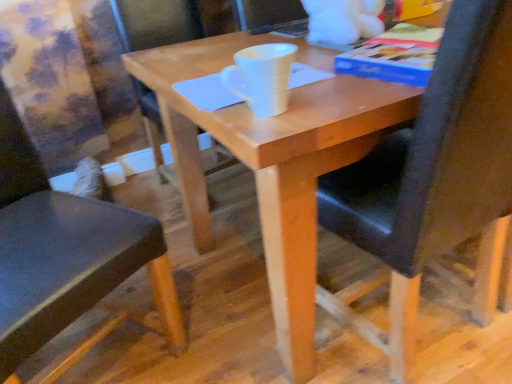
Question: Is white matte mug at center to the left or to the right of black leather chair at center, acting as the first chair starting from the right, in the image?

Choices:
 (A) right
 (B) left

Answer: (B)

Question: Considering their positions, is white matte mug at center located in front of or behind black leather chair at center, acting as the first chair starting from the right?

Choices:
 (A) front
 (B) behind

Answer: (B)

Question: Which object is the farthest from the blue paper at upper right?

Choices:
 (A) black leather chair at center, acting as the 2th chair starting from the left
 (B) wooden table at center
 (C) white matte mug at center
 (D) black leather chair at left, the 2th chair when ordered from right to left

Answer: (D)

Question: Estimate the real-world distances between objects in this image. Which object is farther from the white matte mug at center?

Choices:
 (A) blue paper at upper right
 (B) black leather chair at left, which appears as the first chair when viewed from the left
 (C) wooden table at center
 (D) black leather chair at center, acting as the 2th chair starting from the left

Answer: (B)